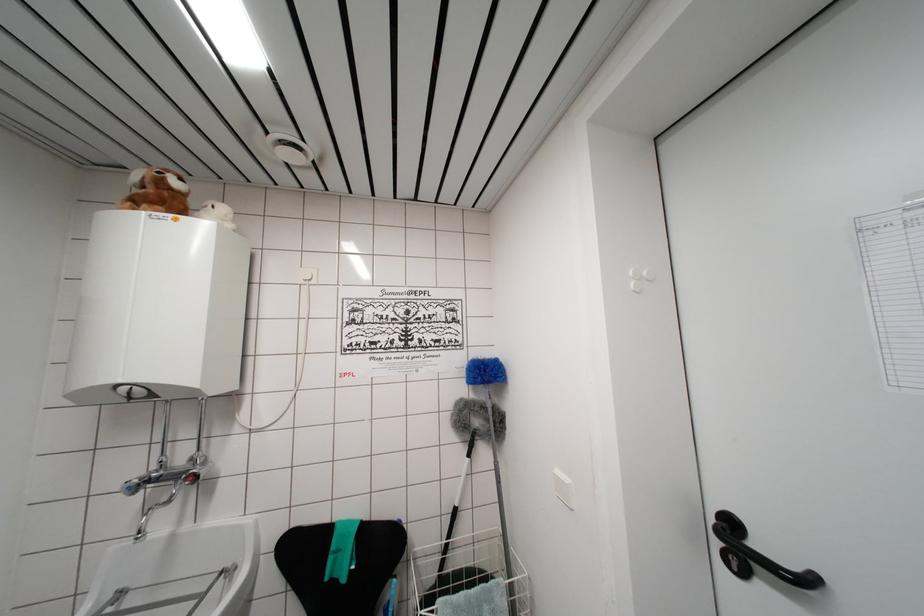
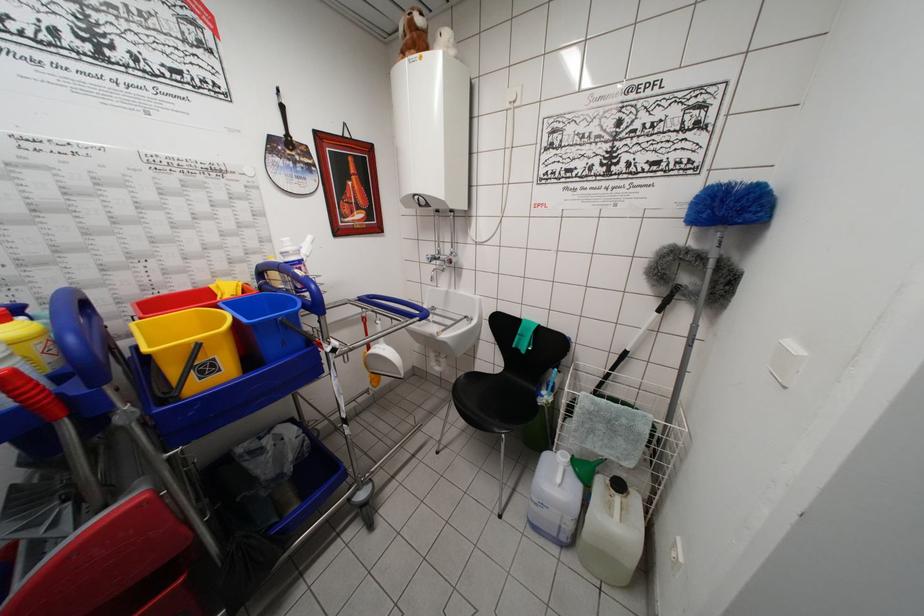
Where in the second image is the point corresponding to [453,540] from the first image?

(616, 374)